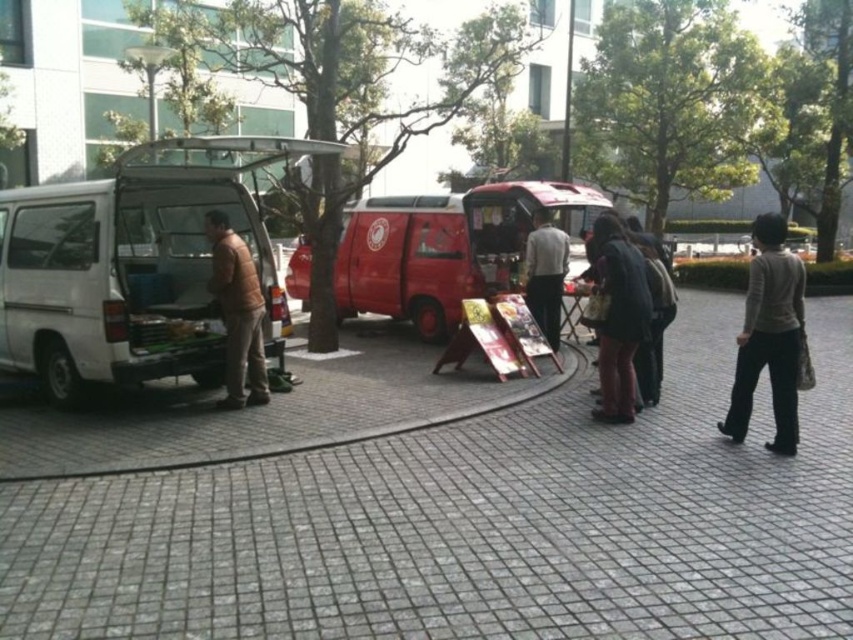
Based on the photo, you are a delivery person who needs to load a box onto the white matte van at left. The box is 1.8 meters tall. Can you safely place the box on top of the dark brown leather jacket at center without exceeding the van height?

The white matte van at left is taller than the dark brown leather jacket at center. Since the box is 1.8 meters tall, it can be safely placed on top of the dark brown leather jacket at center without exceeding the van height.

Consider the image. You are a delivery person who needs to park your 2.5 meter wide truck between the shiny red van at center and the dark brown leather jacket at center. Based on the scene, can your truck fit in the space between them?

The shiny red van at center is wider than the dark brown leather jacket at center. However, the exact distance between them isn t specified. Without knowing the actual space between the two objects, it s impossible to determine if the 2.5 meter wide truck can fit.